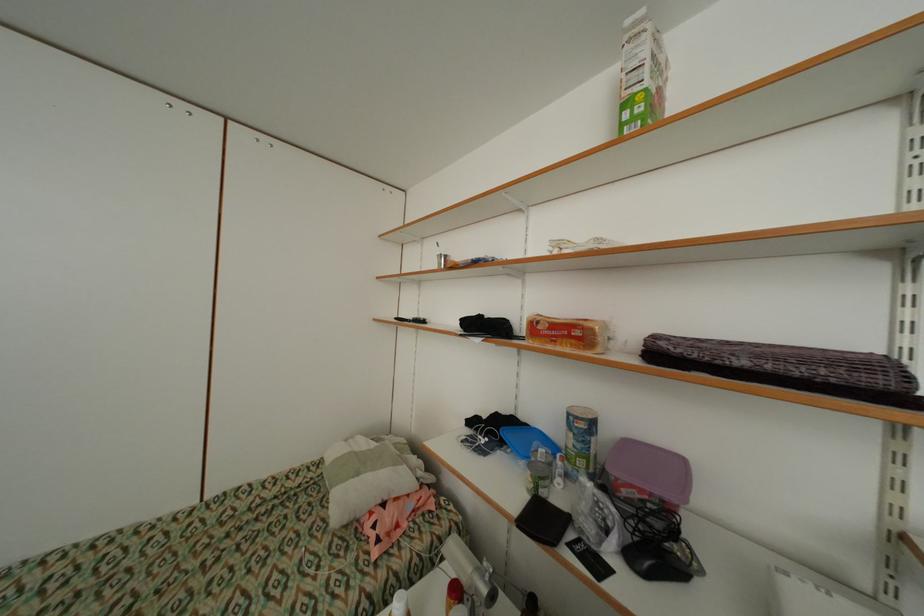
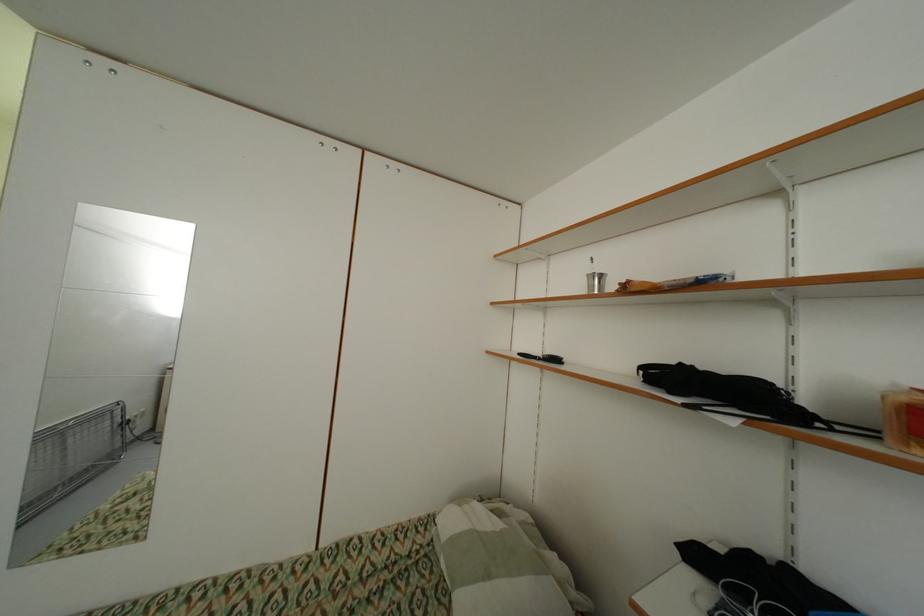
The images are taken continuously from a first-person perspective. In which direction are you moving?

The cameraman walked toward left, forward.